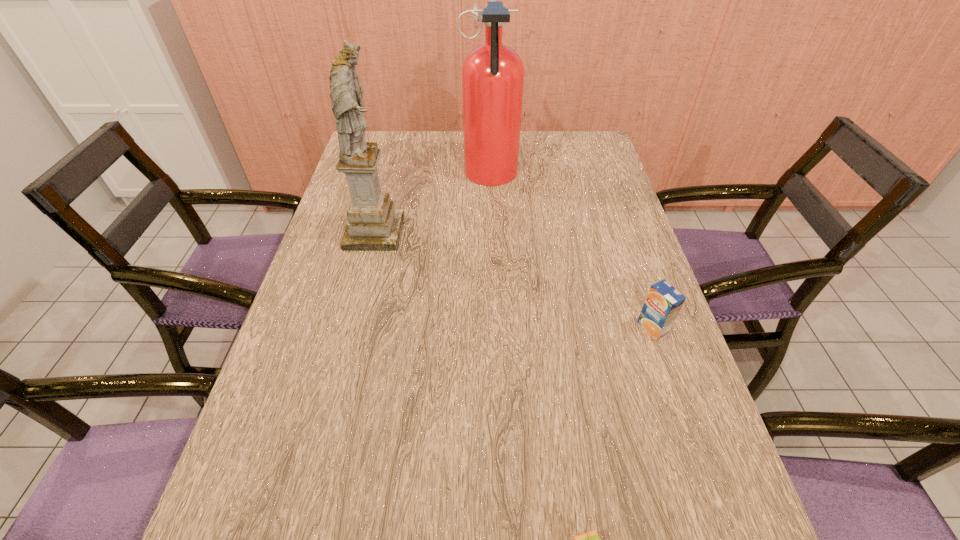
Find the location of a particular element. This screenshot has width=960, height=540. the farthest object is located at coordinates (493, 73).

The image size is (960, 540). I want to click on fire extinguisher, so click(x=493, y=73).

The height and width of the screenshot is (540, 960). I want to click on sculpture, so click(x=374, y=224).

This screenshot has width=960, height=540. I want to click on the leftmost object, so click(374, 224).

You are a GUI agent. You are given a task and a screenshot of the screen. Output one action in this format:
    pyautogui.click(x=<x>, y=<y>)
    Task: Click on the second shortest object
    
    Given the screenshot: What is the action you would take?
    pyautogui.click(x=663, y=303)

Locate an element on the screen. The image size is (960, 540). the farther orange juice is located at coordinates (663, 303).

The width and height of the screenshot is (960, 540). What are the coordinates of `vacant region located on the right of the fire extinguisher` in the screenshot? It's located at (555, 177).

Identify the location of vacant position located 0.050m on the front-facing side of the sculpture. pos(420,233).

You are a GUI agent. You are given a task and a screenshot of the screen. Output one action in this format:
    pyautogui.click(x=<x>, y=<y>)
    Task: Click on the free space located on the left of the farther orange juice
    This screenshot has width=960, height=540.
    Given the screenshot: What is the action you would take?
    pyautogui.click(x=564, y=328)

The height and width of the screenshot is (540, 960). Find the location of `object that is at the far edge`. object that is at the far edge is located at coordinates (493, 73).